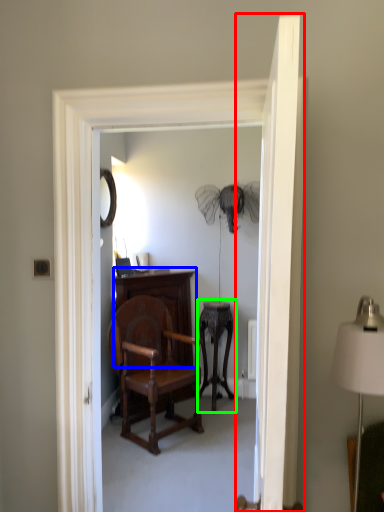
Question: Considering the real-world distances, which object is farthest from door (highlighted by a red box)? vanity (highlighted by a blue box) or side table (highlighted by a green box)?

Choices:
 (A) vanity
 (B) side table

Answer: (B)